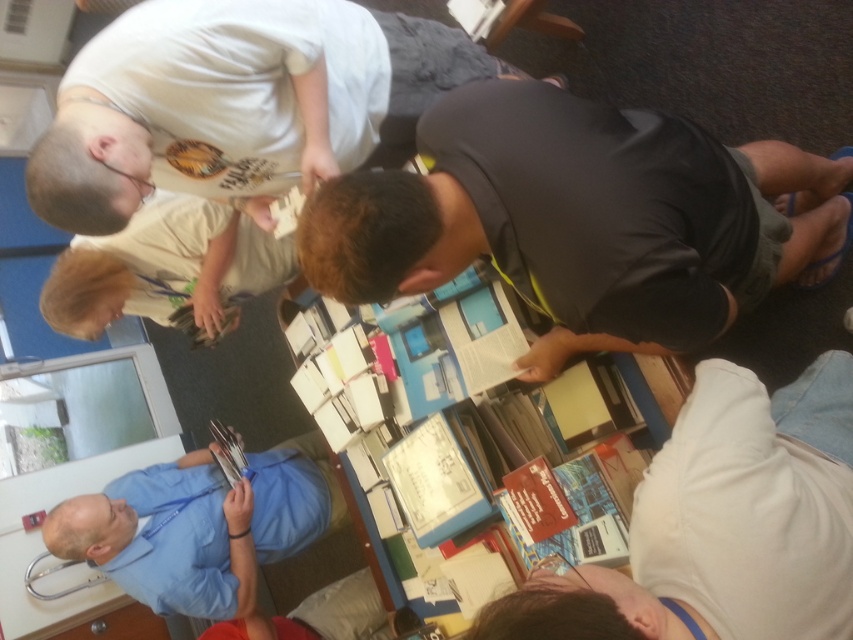
Which is above, black matte shirt at center or white t-shirt at upper left?

white t-shirt at upper left

Can you confirm if black matte shirt at center is thinner than white t-shirt at upper left?

Incorrect, black matte shirt at center's width is not less than white t-shirt at upper left's.

Describe the element at coordinates (583, 220) in the screenshot. Image resolution: width=853 pixels, height=640 pixels. I see `black matte shirt at center` at that location.

At what (x,y) coordinates should I click in order to perform the action: click on black matte shirt at center. Please return your answer as a coordinate pair (x, y). The width and height of the screenshot is (853, 640). Looking at the image, I should click on (583, 220).

Who is more distant from viewer, (567,308) or (253,595)?

The point (253,595) is more distant.

Where is `black matte shirt at center`? This screenshot has width=853, height=640. black matte shirt at center is located at coordinates (583, 220).

Is white fabric shirt at lower right closer to the viewer compared to blue fabric shirt at lower left?

Yes, it is in front of blue fabric shirt at lower left.

Which is more to the left, white fabric shirt at lower right or blue fabric shirt at lower left?

Positioned to the left is blue fabric shirt at lower left.

Describe the element at coordinates (720, 524) in the screenshot. Image resolution: width=853 pixels, height=640 pixels. I see `white fabric shirt at lower right` at that location.

Where is `white fabric shirt at lower right`? white fabric shirt at lower right is located at coordinates 720,524.